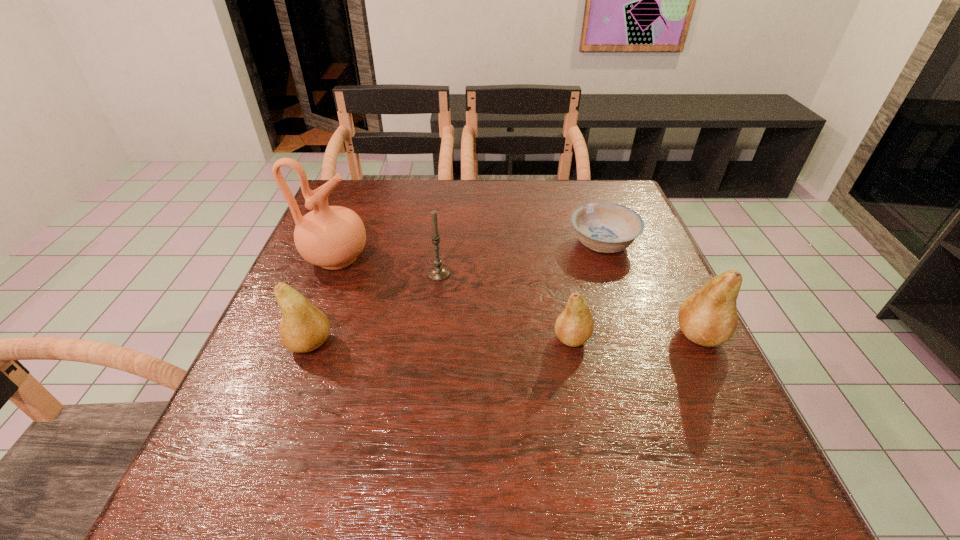
I want to click on the second shortest pear, so click(303, 328).

Find the location of a particular element. The image size is (960, 540). the shortest pear is located at coordinates (574, 326).

Locate an element on the screen. This screenshot has height=540, width=960. the second shortest object is located at coordinates (574, 326).

This screenshot has width=960, height=540. In order to click on the rightmost pear in this screenshot , I will do `click(708, 317)`.

The image size is (960, 540). I want to click on the third object from left to right, so tap(437, 273).

Identify the location of bowl. This screenshot has width=960, height=540. (604, 227).

This screenshot has width=960, height=540. I want to click on the tallest object, so click(332, 237).

Find the location of a particular element. The width and height of the screenshot is (960, 540). vacant space situated on the front of the leftmost pear is located at coordinates click(278, 427).

The height and width of the screenshot is (540, 960). In order to click on vacant region located on the front of the second pear from right to left in this screenshot , I will do `click(588, 415)`.

The image size is (960, 540). I want to click on vacant space located 0.360m on the back of the rightmost pear, so click(644, 222).